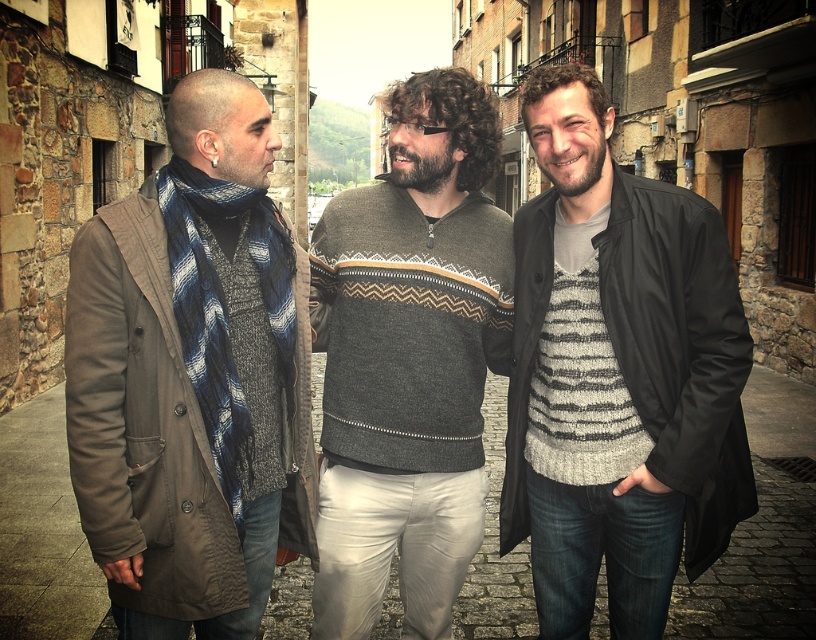
Question: Can you confirm if striped knit sweater at center is bigger than dark gray sweater at center?

Choices:
 (A) yes
 (B) no

Answer: (A)

Question: Does striped knit sweater at center come in front of dark gray sweater at center?

Choices:
 (A) yes
 (B) no

Answer: (A)

Question: Which object is farther from the camera taking this photo?

Choices:
 (A) dark gray sweater at center
 (B) knitted wool sweater at left
 (C) striped knit sweater at center

Answer: (A)

Question: Can you confirm if striped knit sweater at center is wider than knitted wool sweater at left?

Choices:
 (A) no
 (B) yes

Answer: (B)

Question: Which point is closer to the camera?

Choices:
 (A) striped knit sweater at center
 (B) dark gray sweater at center
 (C) knitted wool sweater at left

Answer: (C)

Question: Which object is the farthest from the striped knit sweater at center?

Choices:
 (A) knitted wool sweater at left
 (B) dark gray sweater at center

Answer: (A)